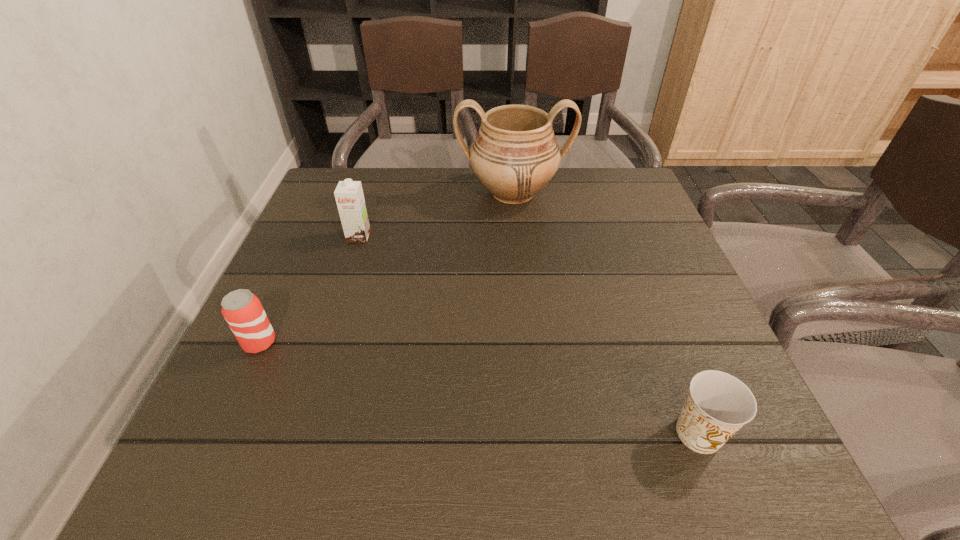
Identify the location of free point between the nearest object and the leftmost object. (479, 388).

Where is `free spot between the second object from right to left and the third object from right to left`? Image resolution: width=960 pixels, height=540 pixels. free spot between the second object from right to left and the third object from right to left is located at coordinates (436, 215).

Locate an element on the screen. This screenshot has width=960, height=540. vacant region between the tallest object and the Dixie cup is located at coordinates (606, 313).

Find the location of a particular element. The image size is (960, 540). vacant point located between the second object from right to left and the leftmost object is located at coordinates (386, 268).

What are the coordinates of `the closest object to the Dixie cup` in the screenshot? It's located at (515, 154).

Identify which object is the third closest to the third farthest object. Please provide its 2D coordinates. Your answer should be formatted as a tuple, i.e. [(x, y)], where the tuple contains the x and y coordinates of a point satisfying the conditions above.

[(718, 404)]

You are a GUI agent. You are given a task and a screenshot of the screen. Output one action in this format:
    pyautogui.click(x=<x>, y=<y>)
    Task: Click on the vacant space that satisfies the following two spatial constraints: 1. on the front-facing side of the second object from right to left; 2. on the right side of the nearest object
    
    Given the screenshot: What is the action you would take?
    pyautogui.click(x=537, y=434)

In order to click on free space that satisfies the following two spatial constraints: 1. on the front-facing side of the urn; 2. on the left side of the Dixie cup in this screenshot , I will do `click(537, 434)`.

Where is `vacant space that satisfies the following two spatial constraints: 1. on the front-facing side of the farthest object; 2. on the right side of the Dixie cup`? Image resolution: width=960 pixels, height=540 pixels. vacant space that satisfies the following two spatial constraints: 1. on the front-facing side of the farthest object; 2. on the right side of the Dixie cup is located at coordinates (537, 434).